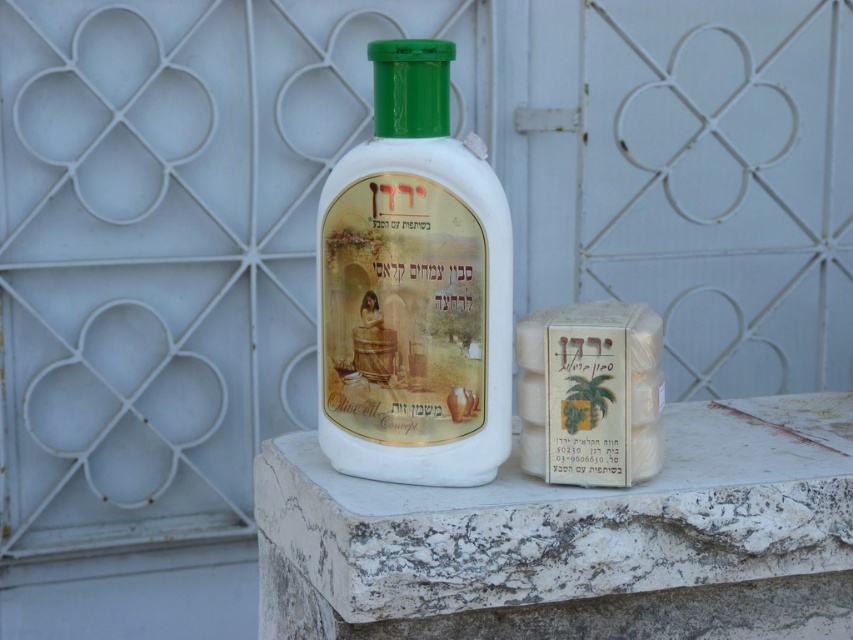
Between point (334, 268) and point (521, 406), which one is positioned in front?

Point (334, 268) is in front.

Who is lower down, white matte bottle at center or white matte soap at center?

Positioned lower is white matte soap at center.

Find the location of a particular element. Image resolution: width=853 pixels, height=640 pixels. white matte bottle at center is located at coordinates (415, 289).

Does white marble at center lie behind white matte bottle at center?

No, it is in front of white matte bottle at center.

Can you confirm if white marble at center is positioned below white matte bottle at center?

Indeed, white marble at center is positioned under white matte bottle at center.

Which is behind, point (440, 621) or point (465, 211)?

Point (440, 621)

Where is `white marble at center`? This screenshot has height=640, width=853. white marble at center is located at coordinates (576, 540).

Consider the image. Is white marble at center smaller than white matte soap at center?

Incorrect, white marble at center is not smaller in size than white matte soap at center.

Describe the element at coordinates (576, 540) in the screenshot. I see `white marble at center` at that location.

This screenshot has width=853, height=640. Describe the element at coordinates (576, 540) in the screenshot. I see `white marble at center` at that location.

I want to click on white marble at center, so click(576, 540).